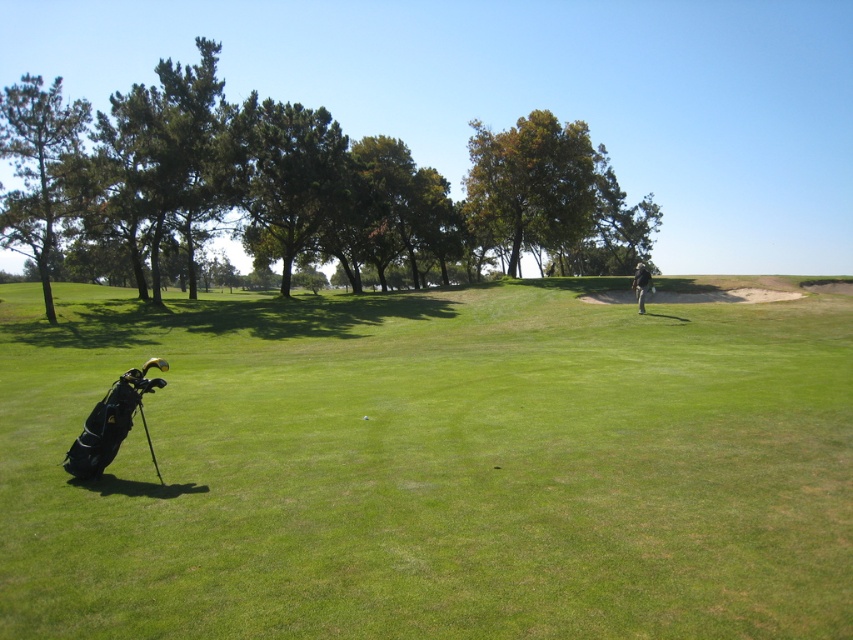
Question: Can you confirm if green leafy tree at left is wider than light brown leather jacket at center?

Choices:
 (A) no
 (B) yes

Answer: (B)

Question: Among these points, which one is nearest to the camera?

Choices:
 (A) [347, 428]
 (B) [105, 240]
 (C) [367, 419]

Answer: (A)

Question: Does black leather golf bag at lower left have a greater width compared to green leafy tree at left?

Choices:
 (A) no
 (B) yes

Answer: (A)

Question: Which object is farther from the camera taking this photo?

Choices:
 (A) light brown leather jacket at center
 (B) green matte tree at left
 (C) white matte golf ball at center
 (D) black leather golf bag at lower left

Answer: (B)

Question: Does green matte tree at left have a greater width compared to white matte golf ball at center?

Choices:
 (A) yes
 (B) no

Answer: (A)

Question: Which point is closer to the camera?

Choices:
 (A) light brown leather jacket at center
 (B) green leafy tree at left

Answer: (A)